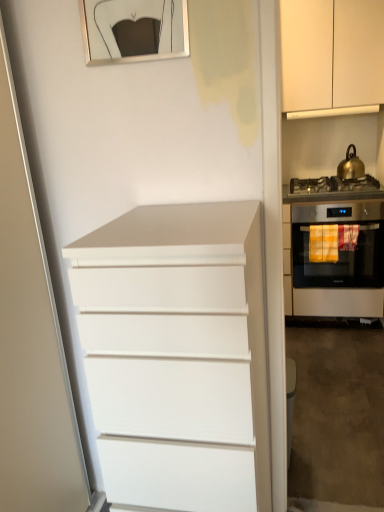
Question: In the image, is white matte chest of drawers at center on the left side or the right side of satin stainless steel oven at right?

Choices:
 (A) left
 (B) right

Answer: (A)

Question: Considering the positions of point (230, 388) and point (294, 245), is point (230, 388) closer or farther from the camera than point (294, 245)?

Choices:
 (A) closer
 (B) farther

Answer: (A)

Question: Estimate the real-world distances between objects in this image. Which object is closer to the metallic gold picture frame at upper center?

Choices:
 (A) satin stainless steel oven at right
 (B) gold metallic kettle at upper right
 (C) white matte chest of drawers at center
 (D) white matte cabinet at upper right
 (E) satin silver gas stove at right

Answer: (C)

Question: Estimate the real-world distances between objects in this image. Which object is closer to the satin silver gas stove at right?

Choices:
 (A) metallic gold picture frame at upper center
 (B) white matte chest of drawers at center
 (C) white matte cabinet at upper right
 (D) gold metallic kettle at upper right
 (E) satin stainless steel oven at right

Answer: (D)